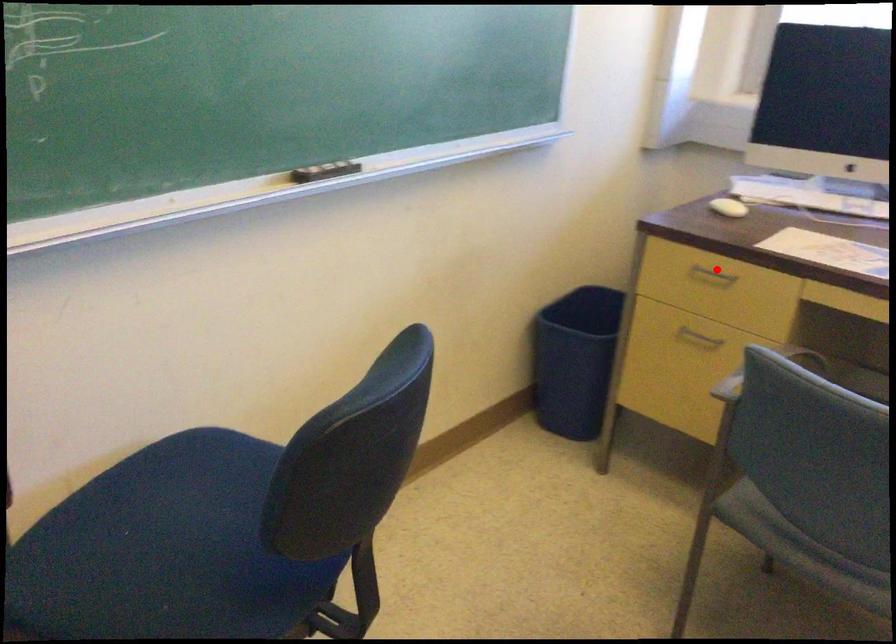
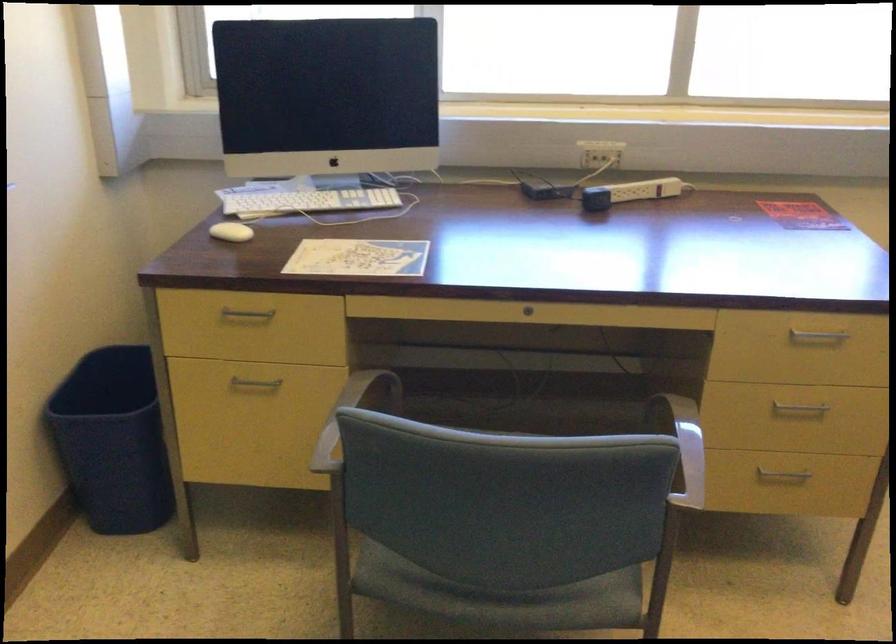
In the second image, find the point that corresponds to the highlighted location in the first image.

(247, 313)